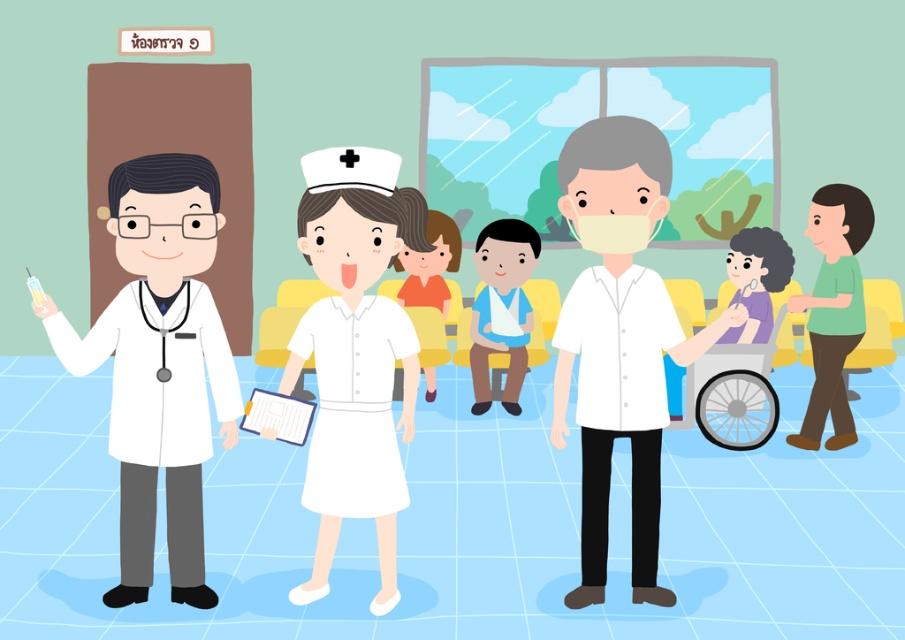
Is point (113, 250) behind point (637, 536)?

Yes, point (113, 250) is behind point (637, 536).

Does white matte doctor coat at left have a greater width compared to white matte shirt at center?

Yes.

Does point (194, 390) come farther from viewer compared to point (596, 145)?

Yes, it is.

The image size is (905, 640). In order to click on white matte doctor coat at left in this screenshot , I will do `click(159, 364)`.

Is white matte shirt at center positioned in front of green matte shirt at right?

Yes, it is in front of green matte shirt at right.

Between white matte shirt at center and green matte shirt at right, which one appears on the right side from the viewer's perspective?

From the viewer's perspective, green matte shirt at right appears more on the right side.

What are the coordinates of `white matte shirt at center` in the screenshot? It's located at (618, 337).

Does white matte doctor coat at left appear under green matte shirt at right?

Yes, white matte doctor coat at left is below green matte shirt at right.

Is white matte doctor coat at left above green matte shirt at right?

No.

Is point (176, 449) closer to camera compared to point (856, 326)?

Yes, it is.

Image resolution: width=905 pixels, height=640 pixels. Identify the location of white matte doctor coat at left. (159, 364).